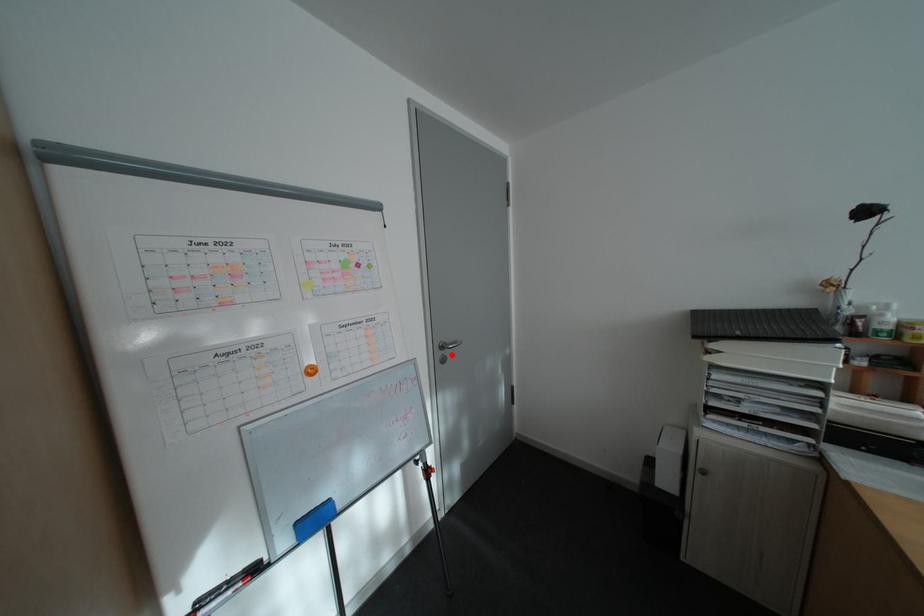
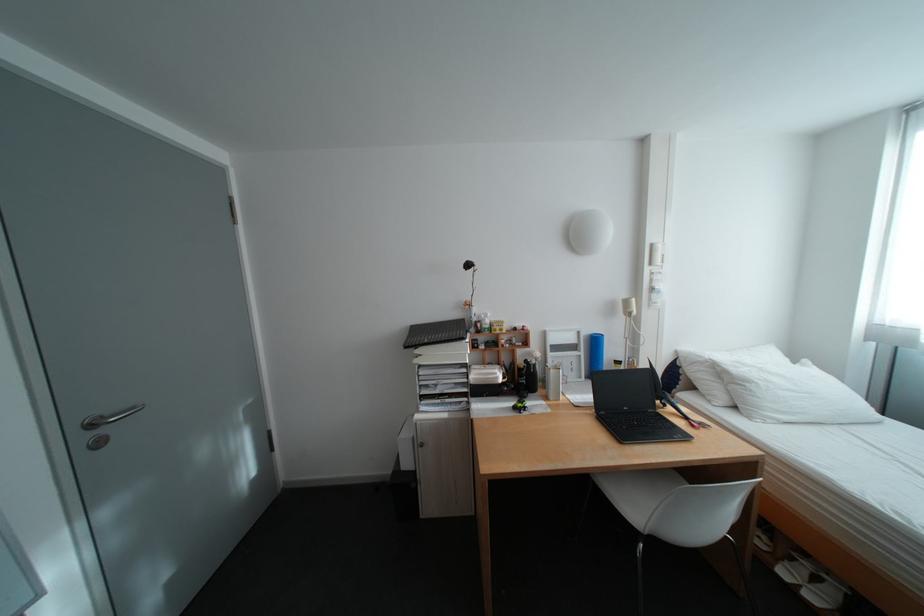
The point at the highlighted location is marked in the first image. Where is the corresponding point in the second image?

(99, 438)